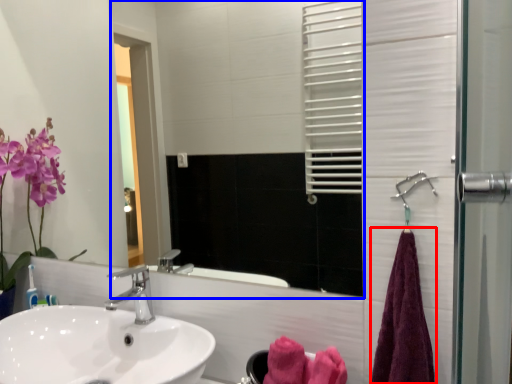
Question: Which point is closer to the camera, bath towel (highlighted by a red box) or mirror (highlighted by a blue box)?

Choices:
 (A) bath towel
 (B) mirror

Answer: (A)